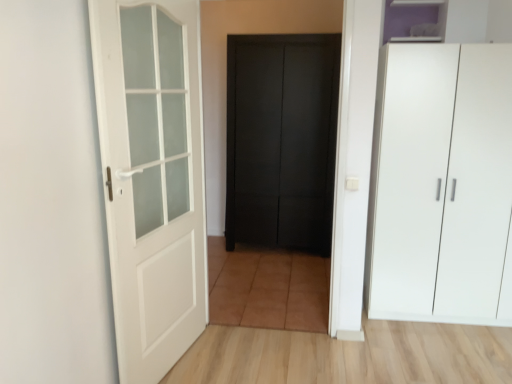
Question: Is white matte cupboard at right in front of or behind white matte door at left, the 2th door when ordered from back to front, in the image?

Choices:
 (A) front
 (B) behind

Answer: (B)

Question: From the image's perspective, relative to white matte door at left, which ranks as the 1th door in front-to-back order, is white matte cupboard at right above or below?

Choices:
 (A) above
 (B) below

Answer: (A)

Question: Which of these objects is positioned closest to the purple matte cabinet at upper right?

Choices:
 (A) white matte cupboard at right
 (B) white matte door at left, the first door positioned from the left
 (C) matte black door at center, acting as the second door starting from the front

Answer: (A)

Question: Based on their relative distances, which object is nearer to the purple matte cabinet at upper right?

Choices:
 (A) white matte cupboard at right
 (B) matte black door at center, acting as the second door starting from the front
 (C) white matte door at left, the first door positioned from the left

Answer: (A)